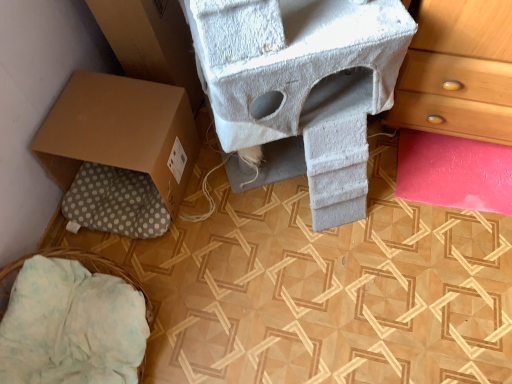
I want to click on empty space that is ontop of brown cardboard box at lower left, so click(x=104, y=121).